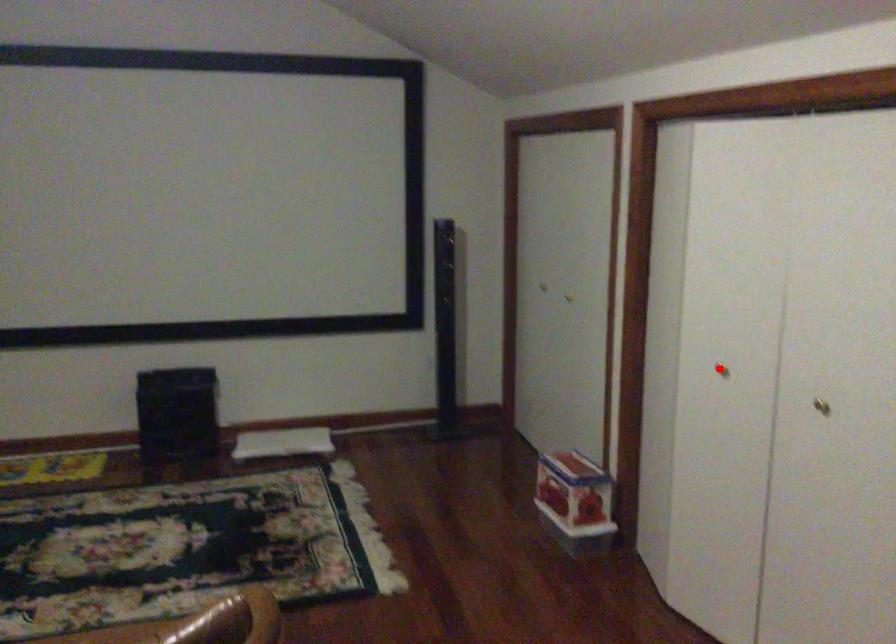
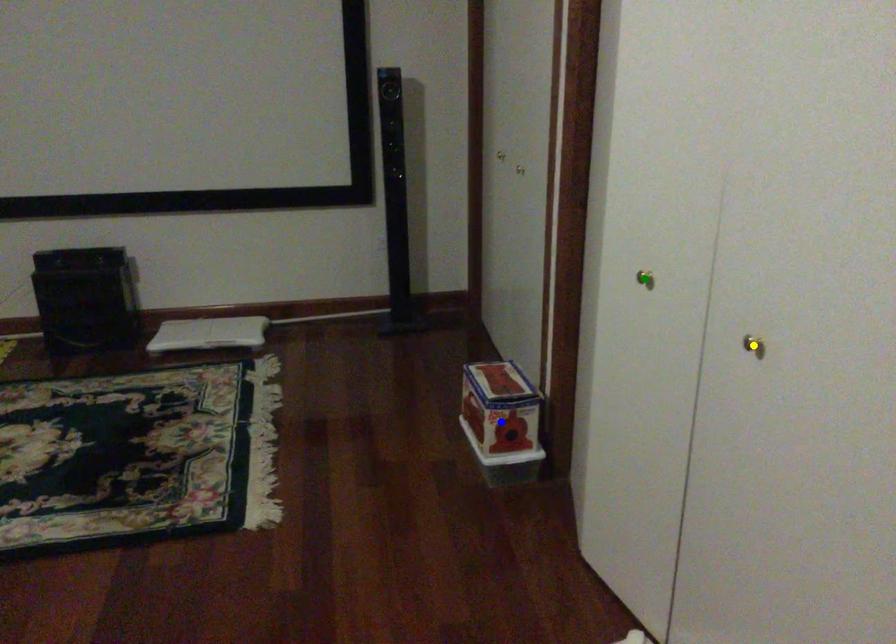
Question: I am providing you with two images of the same scene from different viewpoints. A red point is marked on the first image. You are given multiple points on the second image. Which spot in image 2 lines up with the point in image 1?

Choices:
 (A) blue point
 (B) yellow point
 (C) green point

Answer: (C)